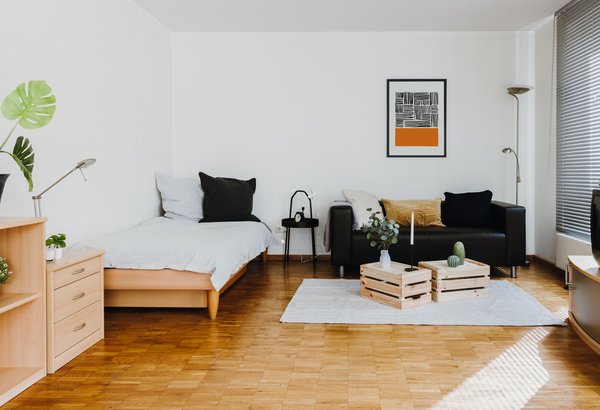
In order to click on lamp in this screenshot , I will do `click(515, 90)`.